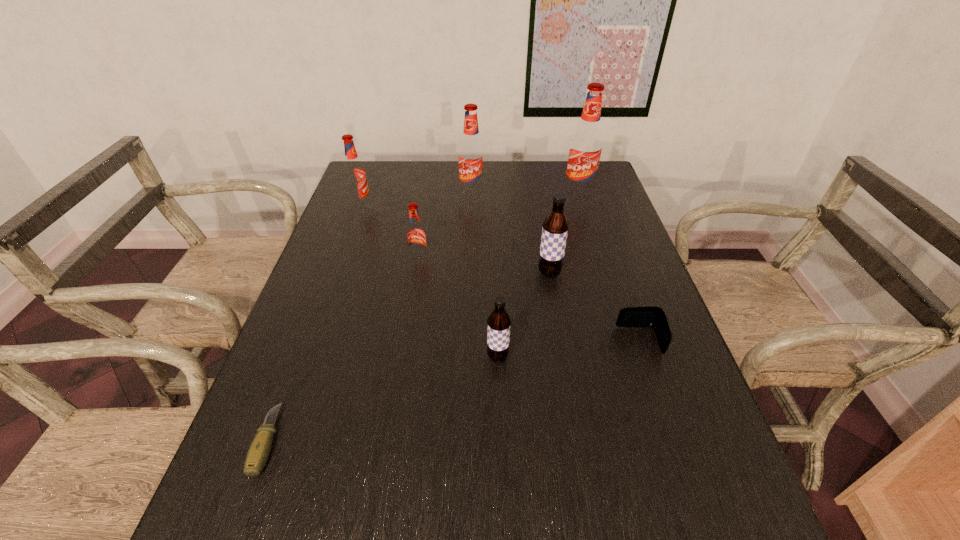
Locate an element on the screen. Image resolution: width=960 pixels, height=540 pixels. free space between the right brown root beer and the leftmost root beer is located at coordinates (455, 240).

Find the location of `free point between the wallet and the right brown root beer`. free point between the wallet and the right brown root beer is located at coordinates (594, 307).

Locate an element on the screen. The image size is (960, 540). vacant space that is in between the right brown root beer and the wallet is located at coordinates (594, 307).

Where is `the seventh closest object relative to the pocketknife`? This screenshot has width=960, height=540. the seventh closest object relative to the pocketknife is located at coordinates (586, 144).

Locate an element on the screen. The height and width of the screenshot is (540, 960). object that is the closest to the leftmost red root beer is located at coordinates (416, 236).

What are the coordinates of `the third closest root beer to the second shortest object` in the screenshot? It's located at (416, 236).

Find the location of `root beer that is the third closest to the fourth root beer from right to left`. root beer that is the third closest to the fourth root beer from right to left is located at coordinates (416, 236).

You are a GUI agent. You are given a task and a screenshot of the screen. Output one action in this format:
    pyautogui.click(x=<x>, y=<y>)
    Task: Click on the red root beer that is the third closest to the fifth object from left to right
    This screenshot has width=960, height=540.
    Given the screenshot: What is the action you would take?
    pyautogui.click(x=586, y=144)

Locate an element on the screen. This screenshot has width=960, height=540. red root beer that is the fourth closest to the nearest root beer is located at coordinates (355, 177).

Identify the location of vacant area that satisfies the following two spatial constraints: 1. on the back side of the rightmost red root beer; 2. on the left side of the leftmost root beer. The image size is (960, 540). (366, 194).